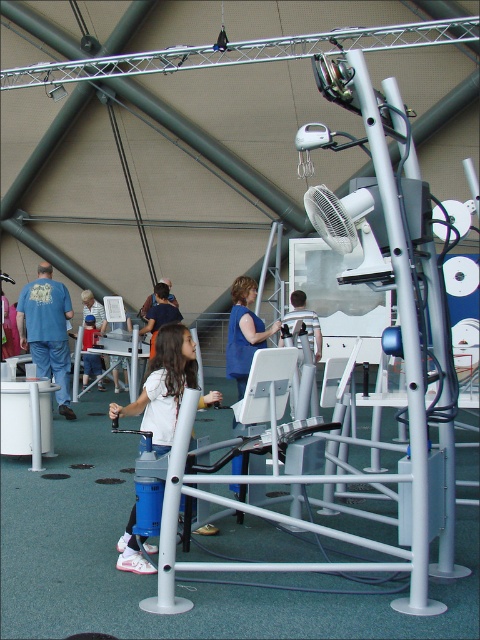
Question: Considering the relative positions of white matte shirt at center and blue denim jeans at left in the image provided, where is white matte shirt at center located with respect to blue denim jeans at left?

Choices:
 (A) right
 (B) left

Answer: (A)

Question: Which of the following is the farthest from the observer?

Choices:
 (A) white matte shirt at center
 (B) blue denim jeans at left
 (C) blue fabric shirt at center
 (D) blue denim jeans at center

Answer: (D)

Question: Is white matte shirt at center bigger than blue denim jeans at left?

Choices:
 (A) yes
 (B) no

Answer: (B)

Question: Which of the following is the closest to the observer?

Choices:
 (A) white matte shirt at center
 (B) blue denim jeans at left
 (C) blue fabric shirt at center

Answer: (A)

Question: Does white matte shirt at center have a larger size compared to blue denim jeans at center?

Choices:
 (A) yes
 (B) no

Answer: (B)

Question: Considering the real-world distances, which object is closest to the white matte shirt at center?

Choices:
 (A) blue denim jeans at left
 (B) blue denim jeans at center
 (C) blue fabric shirt at center

Answer: (C)